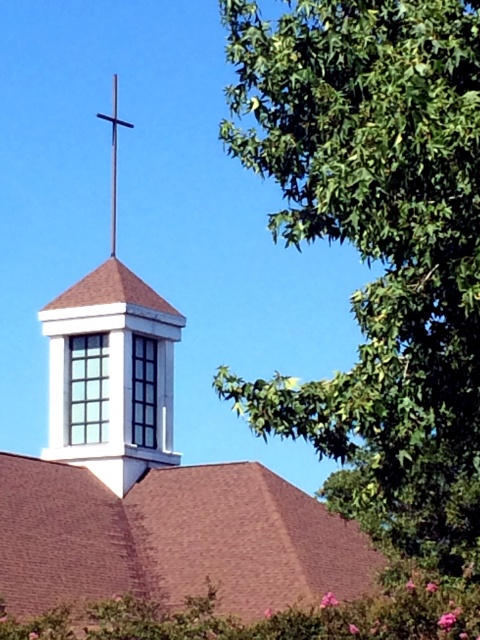
Which is in front, point (58, 365) or point (117, 144)?

Point (58, 365) is in front.

Does white matte steeple at center have a smaller size compared to black metal cross at upper center?

No.

Does point (144, 548) come closer to viewer compared to point (117, 76)?

Yes.

The width and height of the screenshot is (480, 640). In order to click on white matte steeple at center in this screenshot , I will do `click(152, 483)`.

The image size is (480, 640). What do you see at coordinates (172, 538) in the screenshot? I see `brown shingles at center` at bounding box center [172, 538].

Identify the location of brown shingles at center. (172, 538).

Find the location of a particular element. The height and width of the screenshot is (640, 480). brown shingles at center is located at coordinates (172, 538).

How far apart are white matte steeple at center and white matte cross at upper center?

white matte steeple at center is 7.69 meters away from white matte cross at upper center.

Does white matte steeple at center have a greater height compared to white matte cross at upper center?

Incorrect, white matte steeple at center's height is not larger of white matte cross at upper center's.

Where is `white matte steeple at center`? The image size is (480, 640). white matte steeple at center is located at coordinates [x=152, y=483].

Locate an element on the screen. The width and height of the screenshot is (480, 640). white matte steeple at center is located at coordinates (152, 483).